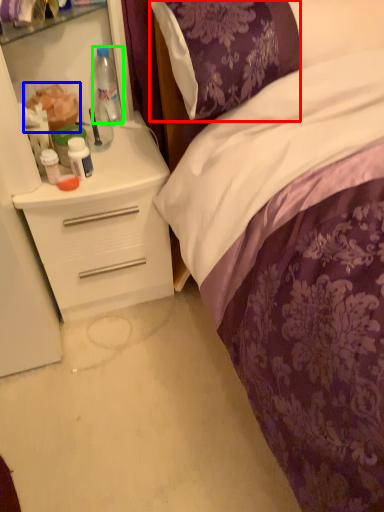
Question: Which object is the farthest from pillow (highlighted by a red box)? Choose among these: food (highlighted by a blue box) or bottle (highlighted by a green box).

Choices:
 (A) food
 (B) bottle

Answer: (A)